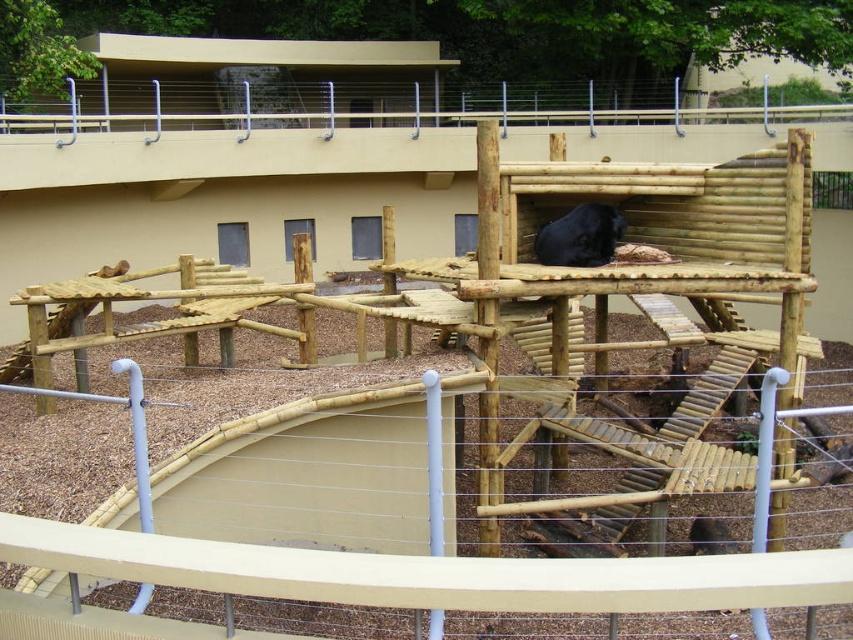
Is wooden fence at lower center positioned at the back of black fur/black coat at center?

No, wooden fence at lower center is closer to the viewer.

Is wooden fence at lower center positioned in front of black fur/black coat at center?

Yes, it is.

Which is behind, point (347, 557) or point (578, 234)?

Positioned behind is point (578, 234).

You are a GUI agent. You are given a task and a screenshot of the screen. Output one action in this format:
    pyautogui.click(x=<x>, y=<y>)
    Task: Click on the wooden fence at lower center
    The height and width of the screenshot is (640, 853).
    Given the screenshot: What is the action you would take?
    pyautogui.click(x=380, y=564)